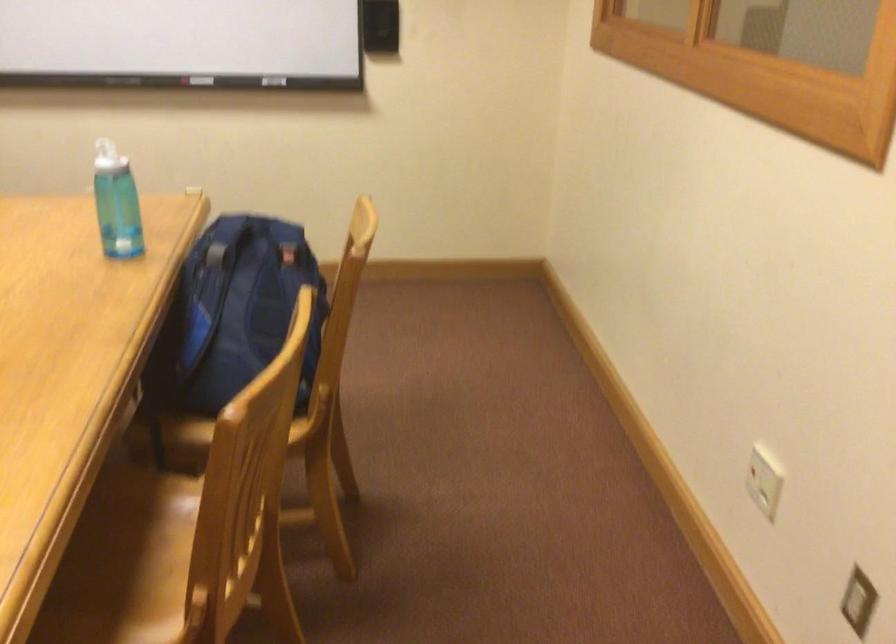
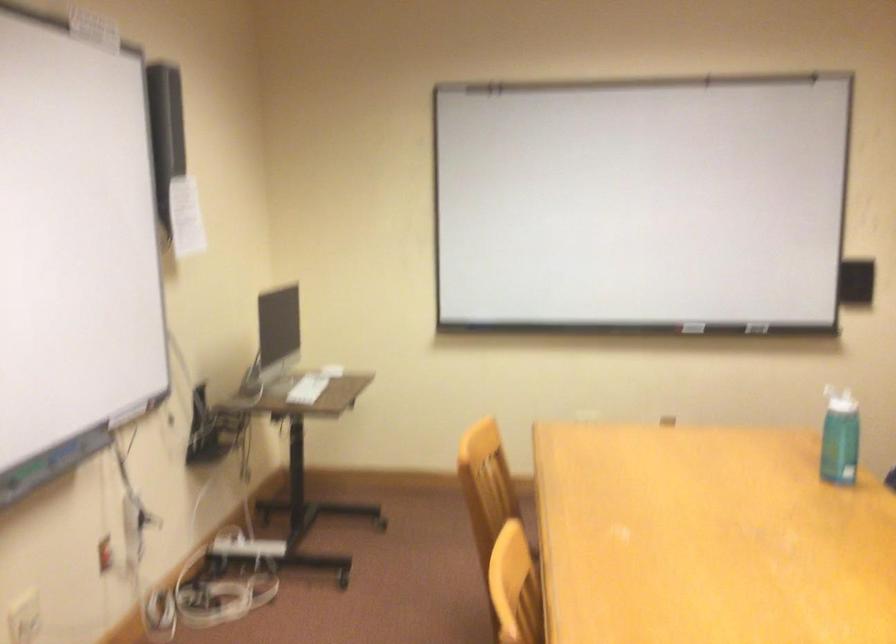
First-person continuous shooting, in which direction is the camera rotating?

The rotation direction of the camera is left-up.